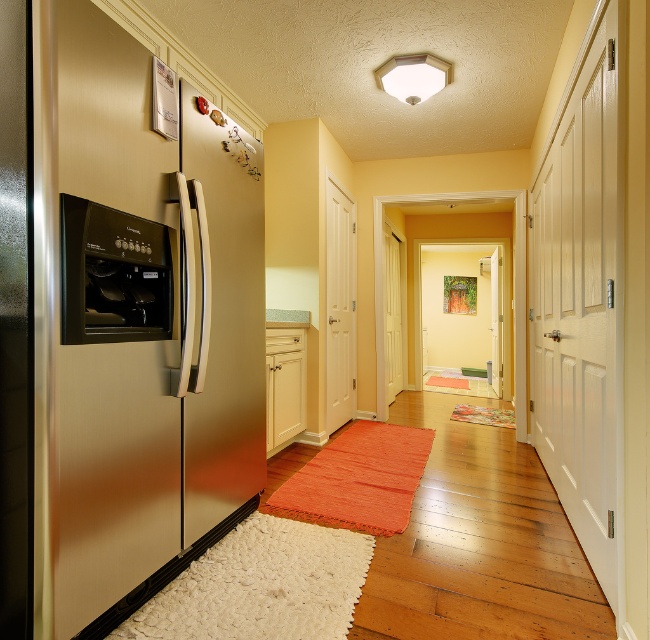
You are a delivery person carrying a package that is 1.8 meters tall. You need to place it in the hallway without blocking the entrance. Considering the height of the stainless steel refrigerator at left and the satin black oven at left, which appliance can the package be placed next to without exceeding its height?

The stainless steel refrigerator at left has a greater height compared to the satin black oven at left. Therefore, the package can be placed next to the satin black oven at left since its height is lower than the package, allowing the package to be placed there without exceeding the height limit.

You are moving into a new apartment and need to place a new microwave between the stainless steel refrigerator at left and the satin black oven at left. Based on their current positions, which appliance should the microwave be placed closer to?

The microwave should be placed closer to the satin black oven at left because the stainless steel refrigerator at left is positioned on the right side of the satin black oven at left, meaning the oven is further to the left.

You are moving a 1.5 meter wide sofa through the hallway. The sofa needs to pass between the stainless steel refrigerator at left and the satin black oven at left. Can the sofa fit through the space between them?

The stainless steel refrigerator at left is wider than the satin black oven at left. Since the sofa is 1.5 meters wide, it depends on the total available space between them. However, the description only states the refrigerator is wider, not the exact distance. Without knowing the exact gap, we cannot confirm if the sofa will fit.